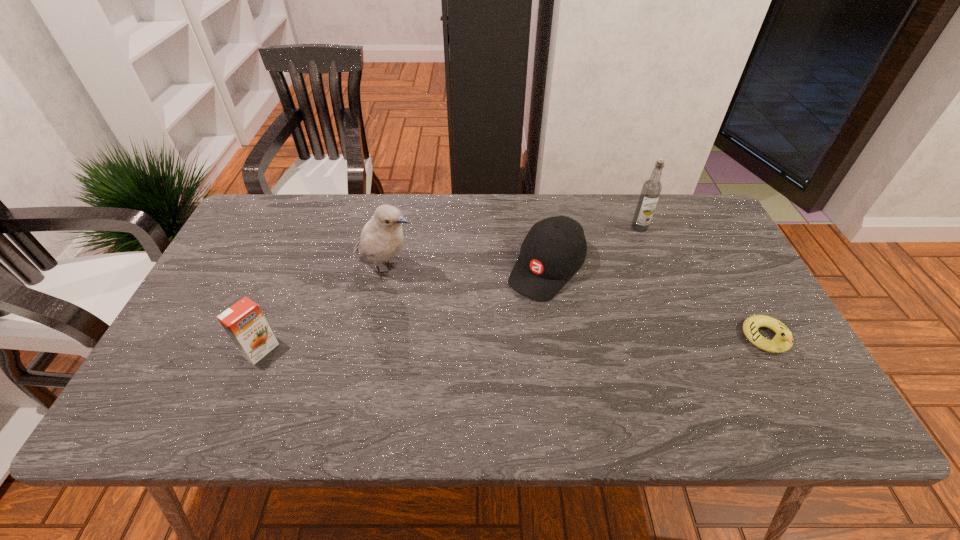
Find the location of a particular element. The image size is (960, 540). free spot at the near right corner of the desktop is located at coordinates (796, 373).

The height and width of the screenshot is (540, 960). I want to click on vacant space in between the shortest object and the third object from right to left, so click(657, 303).

In order to click on empty space between the fourth object from left to right and the orange juice in this screenshot , I will do `click(450, 289)`.

You are a GUI agent. You are given a task and a screenshot of the screen. Output one action in this format:
    pyautogui.click(x=<x>, y=<y>)
    Task: Click on the unoccupied position between the leftmost object and the baseball cap
    
    Given the screenshot: What is the action you would take?
    pyautogui.click(x=403, y=309)

At what (x,y) coordinates should I click in order to perform the action: click on vacant region between the shortest object and the farthest object. Please return your answer as a coordinate pair (x, y). This screenshot has width=960, height=540. Looking at the image, I should click on (703, 283).

I want to click on blank region between the fourth object from right to left and the baseball cap, so click(467, 269).

At what (x,y) coordinates should I click in order to perform the action: click on vacant point located between the bird and the baseball cap. Please return your answer as a coordinate pair (x, y). The image size is (960, 540). Looking at the image, I should click on (467, 269).

Image resolution: width=960 pixels, height=540 pixels. Identify the location of vacant area that lies between the rightmost object and the fourth object from right to left. (576, 303).

The image size is (960, 540). Find the location of `free space between the leftmost object and the shortest object`. free space between the leftmost object and the shortest object is located at coordinates (514, 344).

The image size is (960, 540). I want to click on empty location between the baseball cap and the orange juice, so click(x=403, y=309).